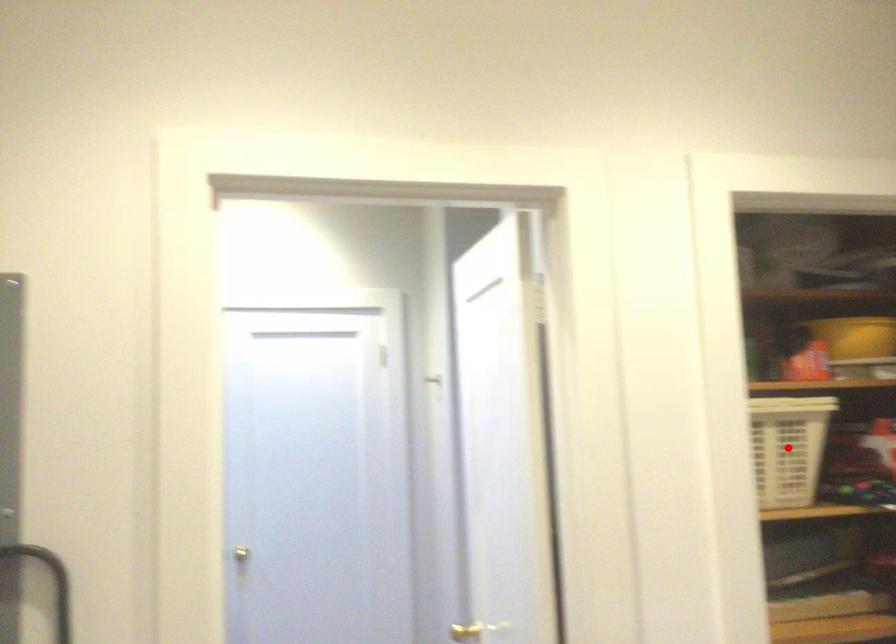
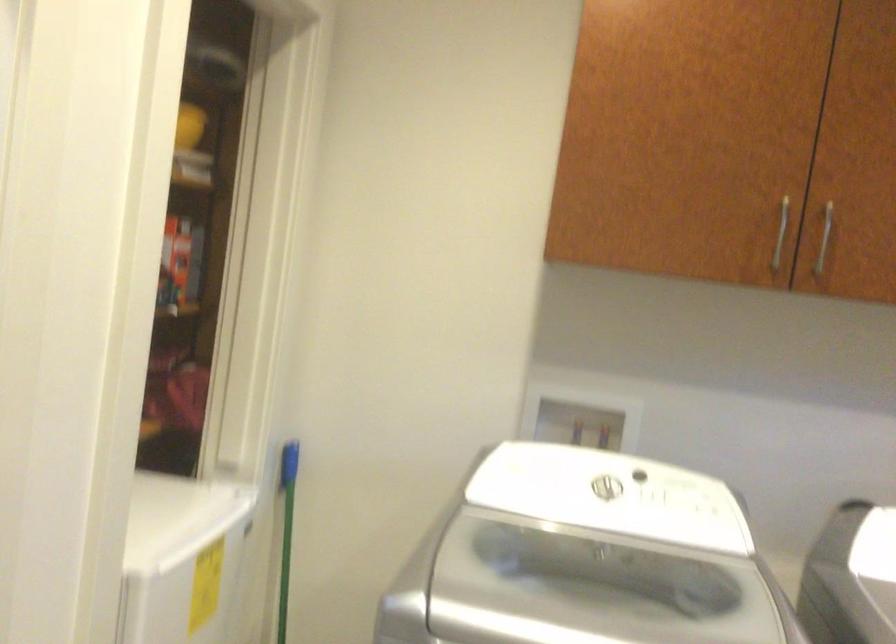
Question: I am providing you with two images of the same scene from different viewpoints. A red point is marked on the first image. At the location where the point appears in image 1, is it still visible in image 2?

Choices:
 (A) Yes
 (B) No

Answer: (B)